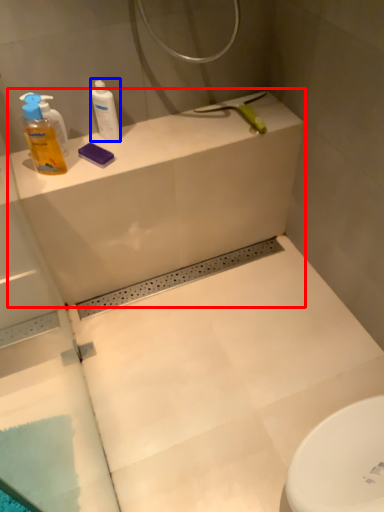
Question: Which object is closer to the camera taking this photo, counter top (highlighted by a red box) or cleaning product (highlighted by a blue box)?

Choices:
 (A) counter top
 (B) cleaning product

Answer: (A)